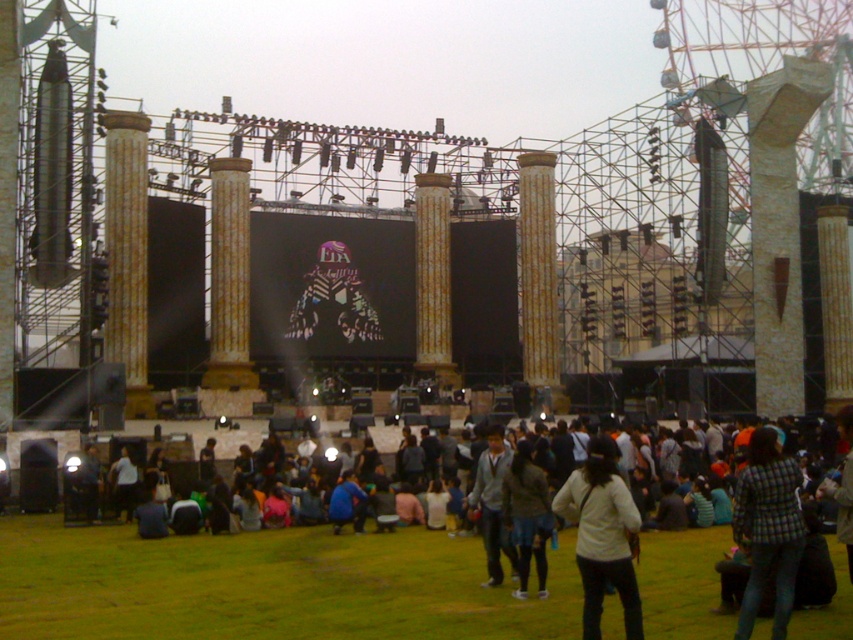
Question: Is white matte shirt at center positioned behind gray sweater at center?

Choices:
 (A) yes
 (B) no

Answer: (B)

Question: Among these objects, which one is farthest from the camera?

Choices:
 (A) plaid fabric jacket at lower right
 (B) gray sweater at center

Answer: (B)

Question: Among these points, which one is farthest from the camera?

Choices:
 (A) (352, 628)
 (B) (775, 618)
 (C) (590, 513)

Answer: (C)

Question: Where is white matte shirt at center located in relation to plaid fabric jacket at lower right in the image?

Choices:
 (A) left
 (B) right

Answer: (A)

Question: Does plaid fabric jacket at lower right appear under dark gray fabric jacket at center?

Choices:
 (A) no
 (B) yes

Answer: (A)

Question: Which is nearer to the dark gray fabric jacket at center?

Choices:
 (A) gray sweater at center
 (B) white casual clothing at center

Answer: (A)